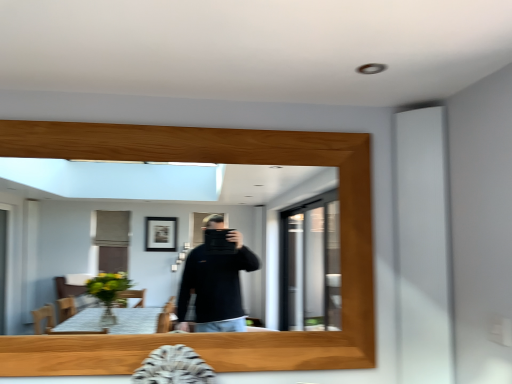
Identify the location of empty space that is ontop of wooden mirror at center (from a real-world perspective). This screenshot has width=512, height=384. (178, 117).